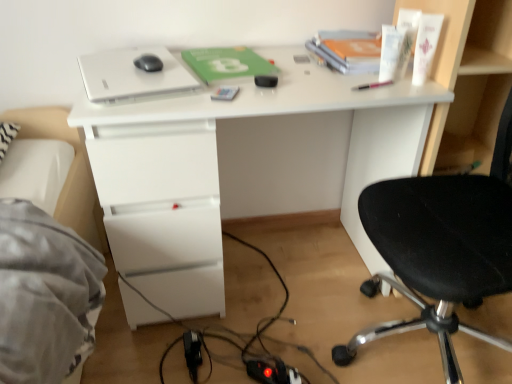
Question: From the image's perspective, is metallic silver phone at center, positioned as the 2th stationery in right-to-left order, located above or below pink plastic pen at upper right, which is the second stationery from left to right?

Choices:
 (A) below
 (B) above

Answer: (A)

Question: In terms of width, does metallic silver phone at center, the first stationery from the left, look wider or thinner when compared to pink plastic pen at upper right, positioned as the 1th stationery in right-to-left order?

Choices:
 (A) thin
 (B) wide

Answer: (B)

Question: Which is nearer to the white matte laptop at upper center?

Choices:
 (A) black fabric chair at right
 (B) black matte mouse at upper center
 (C) green matte paperback book at center
 (D) white glossy desk at center
 (E) metallic silver phone at center, the first stationery from the left

Answer: (B)

Question: Estimate the real-world distances between objects in this image. Which object is closer to the black fabric chair at right?

Choices:
 (A) green matte paperback book at center
 (B) white matte laptop at upper center
 (C) metallic silver phone at center, the first stationery from the left
 (D) pink plastic pen at upper right, positioned as the 1th stationery in right-to-left order
 (E) white glossy desk at center

Answer: (D)